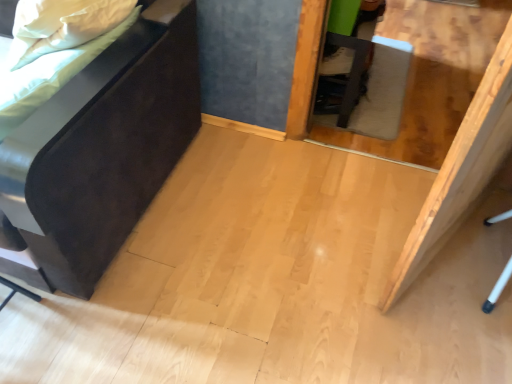
What are the coordinates of `velvet dark brown bed at left` in the screenshot? It's located at (100, 152).

Describe the element at coordinates (100, 152) in the screenshot. The height and width of the screenshot is (384, 512). I see `velvet dark brown bed at left` at that location.

Find the location of a particular element. Image resolution: width=512 pixels, height=384 pixels. velvet dark brown bed at left is located at coordinates (100, 152).